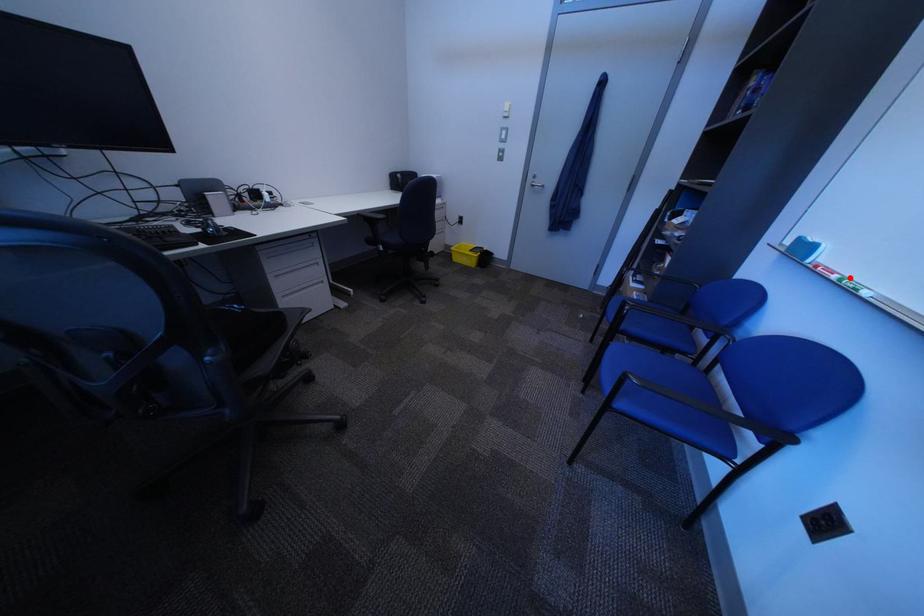
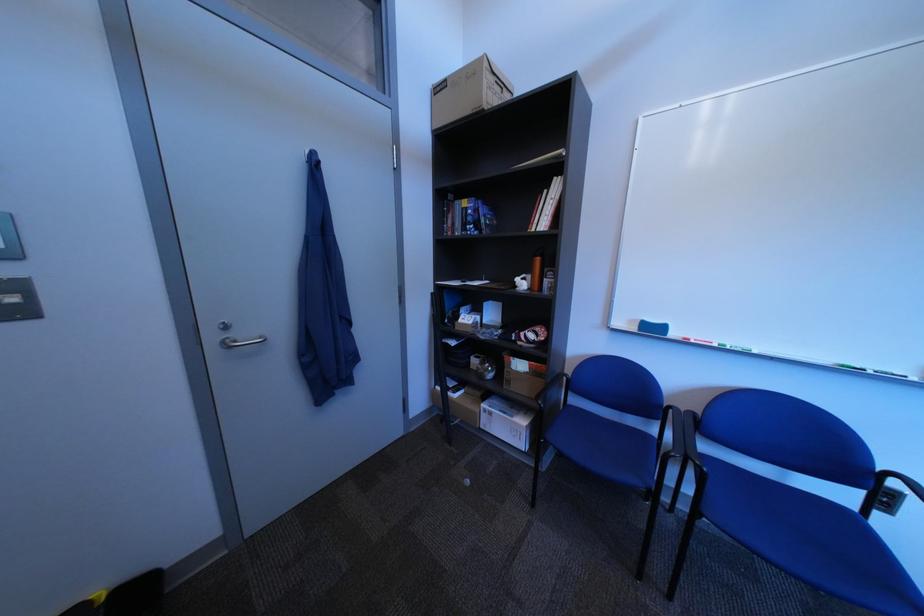
Where in the second image is the point corresponding to the highlighted location from the first image?

(732, 347)